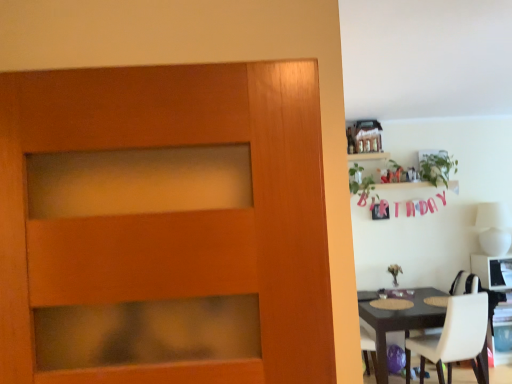
Question: Would you say matte brown table at right is a long distance from white glossy computer desk at right?

Choices:
 (A) no
 (B) yes

Answer: (A)

Question: From the image's perspective, is matte brown table at right on top of white glossy computer desk at right?

Choices:
 (A) yes
 (B) no

Answer: (B)

Question: Can you confirm if matte brown table at right is smaller than white glossy computer desk at right?

Choices:
 (A) no
 (B) yes

Answer: (A)

Question: Considering the relative sizes of matte brown table at right and white glossy computer desk at right in the image provided, is matte brown table at right thinner than white glossy computer desk at right?

Choices:
 (A) yes
 (B) no

Answer: (B)

Question: Considering the relative sizes of matte brown table at right and white glossy computer desk at right in the image provided, is matte brown table at right shorter than white glossy computer desk at right?

Choices:
 (A) no
 (B) yes

Answer: (B)

Question: From the image's perspective, is white leather chair at lower right positioned above or below white glossy computer desk at right?

Choices:
 (A) below
 (B) above

Answer: (A)

Question: Considering their positions, is white leather chair at lower right located in front of or behind white glossy computer desk at right?

Choices:
 (A) front
 (B) behind

Answer: (A)

Question: From a real-world perspective, is white leather chair at lower right physically located above or below white glossy computer desk at right?

Choices:
 (A) below
 (B) above

Answer: (A)

Question: Choose the correct answer: Is white leather chair at lower right inside white glossy computer desk at right or outside it?

Choices:
 (A) inside
 (B) outside

Answer: (B)

Question: In terms of width, does wooden shelf at upper right look wider or thinner when compared to white leather chair at lower right?

Choices:
 (A) thin
 (B) wide

Answer: (A)

Question: Which is correct: wooden shelf at upper right is inside white leather chair at lower right, or outside of it?

Choices:
 (A) inside
 (B) outside

Answer: (B)

Question: From the image's perspective, is wooden shelf at upper right located above or below white leather chair at lower right?

Choices:
 (A) above
 (B) below

Answer: (A)

Question: Based on their sizes in the image, would you say wooden shelf at upper right is bigger or smaller than white leather chair at lower right?

Choices:
 (A) small
 (B) big

Answer: (A)

Question: Considering their positions, is white leather chair at lower right located in front of or behind matte brown table at right?

Choices:
 (A) front
 (B) behind

Answer: (A)

Question: Is white leather chair at lower right situated inside matte brown table at right or outside?

Choices:
 (A) inside
 (B) outside

Answer: (A)